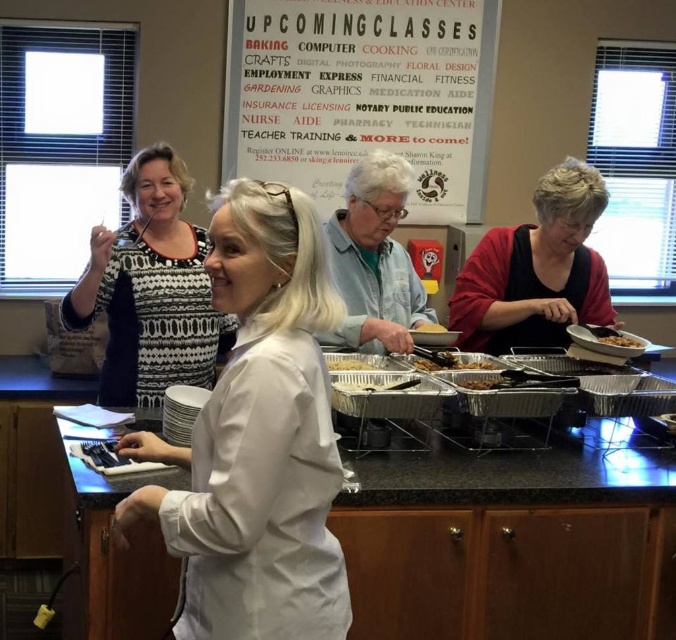
Question: Is brown matte bowl at center to the right of brown matte bowl at right from the viewer's perspective?

Choices:
 (A) no
 (B) yes

Answer: (A)

Question: Can you confirm if white matte lab coat at center is thinner than brown matte bowl at center?

Choices:
 (A) yes
 (B) no

Answer: (B)

Question: Which object appears farthest from the camera in this image?

Choices:
 (A) brown matte bowl at right
 (B) white paper poster at upper center
 (C) red sweater at right

Answer: (B)

Question: Among these objects, which one is farthest from the camera?

Choices:
 (A) patterned fabric sweater at upper left
 (B) white paper poster at upper center

Answer: (B)

Question: Does white paper poster at upper center appear on the right side of brown matte bowl at right?

Choices:
 (A) no
 (B) yes

Answer: (A)

Question: Among these points, which one is nearest to the camera?

Choices:
 (A) (270, 17)
 (B) (619, 340)
 (C) (338, 364)
 (D) (606, 344)

Answer: (C)